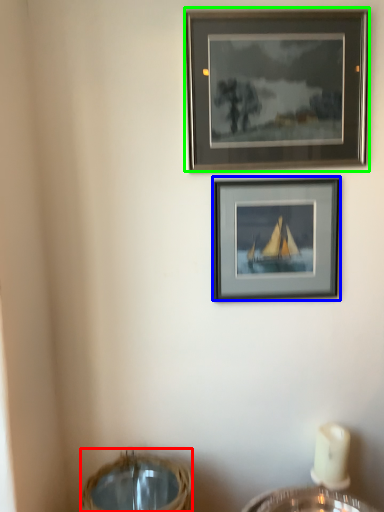
Question: Which object is the farthest from basket (highlighted by a red box)? Choose among these: picture frame (highlighted by a blue box) or picture frame (highlighted by a green box).

Choices:
 (A) picture frame
 (B) picture frame

Answer: (B)